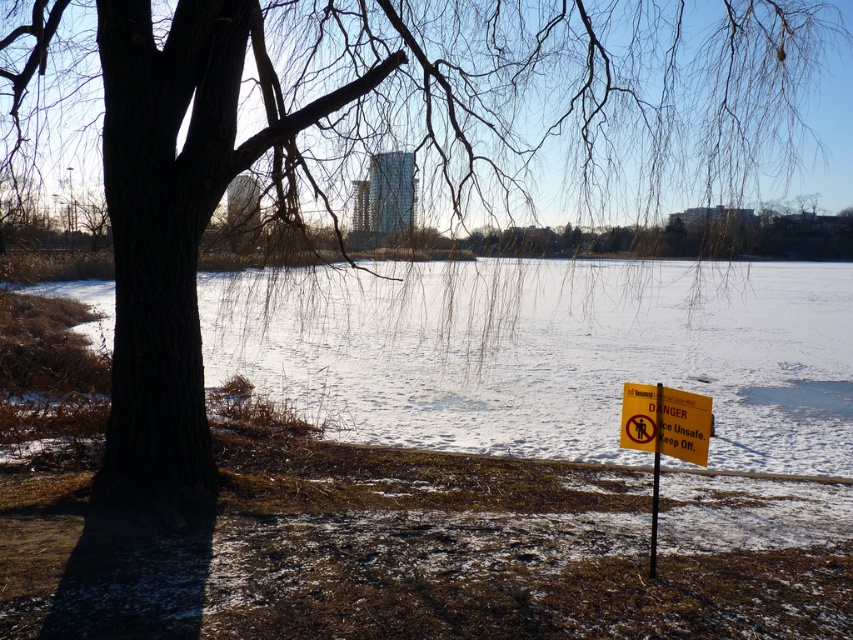
Question: Which object is positioned closest to the yellow paper sign at lower right?

Choices:
 (A) white frozen water at center
 (B) yellow paper sign at lower center
 (C) yellow plastic sign at lower right

Answer: (B)

Question: Estimate the real-world distances between objects in this image. Which object is closer to the yellow paper sign at lower right?

Choices:
 (A) yellow plastic sign at lower right
 (B) white frozen water at center

Answer: (A)

Question: Does yellow paper sign at lower center appear on the left side of yellow plastic sign at lower right?

Choices:
 (A) no
 (B) yes

Answer: (B)

Question: Does white frozen water at center have a greater width compared to yellow paper sign at lower center?

Choices:
 (A) no
 (B) yes

Answer: (B)

Question: Can you confirm if white frozen water at center is positioned to the right of yellow paper sign at lower center?

Choices:
 (A) no
 (B) yes

Answer: (A)

Question: Which point is closer to the camera taking this photo?

Choices:
 (A) (657, 422)
 (B) (753, 403)
 (C) (621, 422)

Answer: (A)